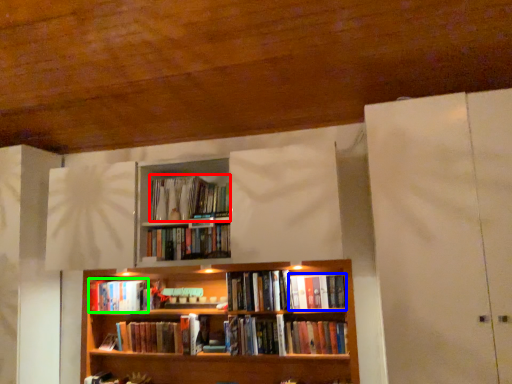
Question: Based on their relative distances, which object is nearer to book (highlighted by a red box)? Choose from book (highlighted by a blue box) and book (highlighted by a green box).

Choices:
 (A) book
 (B) book

Answer: (B)